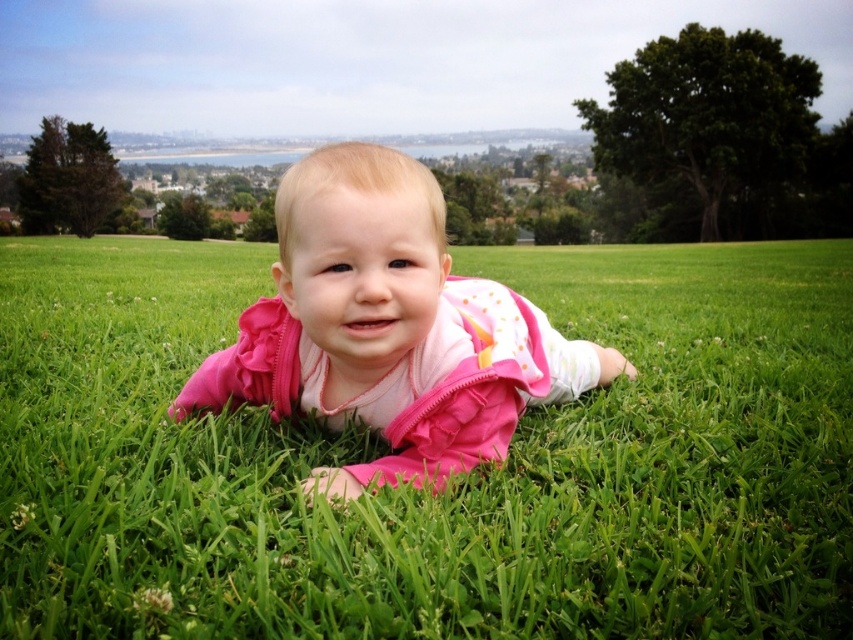
You are a photographer trying to capture a closeup of the pink fabric baby at center. Based on the coordinates provided, which direction should you move your camera to focus on the baby?

You should move your camera to the center of the image because the pink fabric baby at center is located at point (427,484), which is near the center.

You are a photographer trying to capture the baby in the image. You notice two pink items at the center. Which one is higher up, the pink fabric baby at center or the pink fleece baby at center?

The pink fabric baby at center is located above the pink fleece baby at center, so it is higher up.

You are a photographer setting up for a baby photoshoot in a park. You have two baby outfits to choose from, the pink fabric baby at center and the pink fleece baby at center. The client wants the baby to be visible from a distance. Which outfit would you choose and why?

The pink fabric baby at center and pink fleece baby at center are 2.75 meters apart. Since the fabric outfit is likely lighter and more formfitting, it may create a clearer silhouette from a distance compared to the fleece, which could appear bulkier and less defined. However, both are the same color and at the same distance, so visibility might be similar. But if one needs to stand out more, the fabric might be better due to its shape clarity.